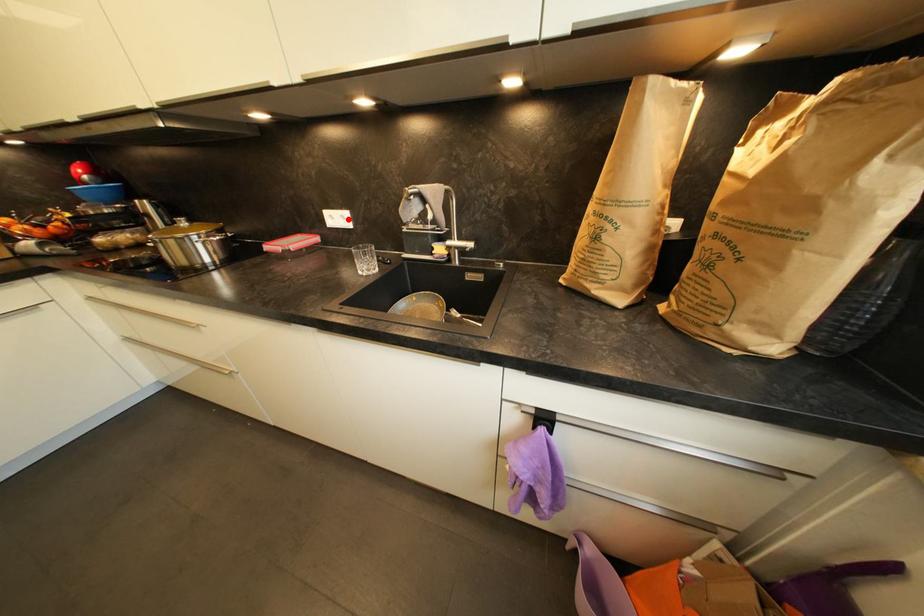
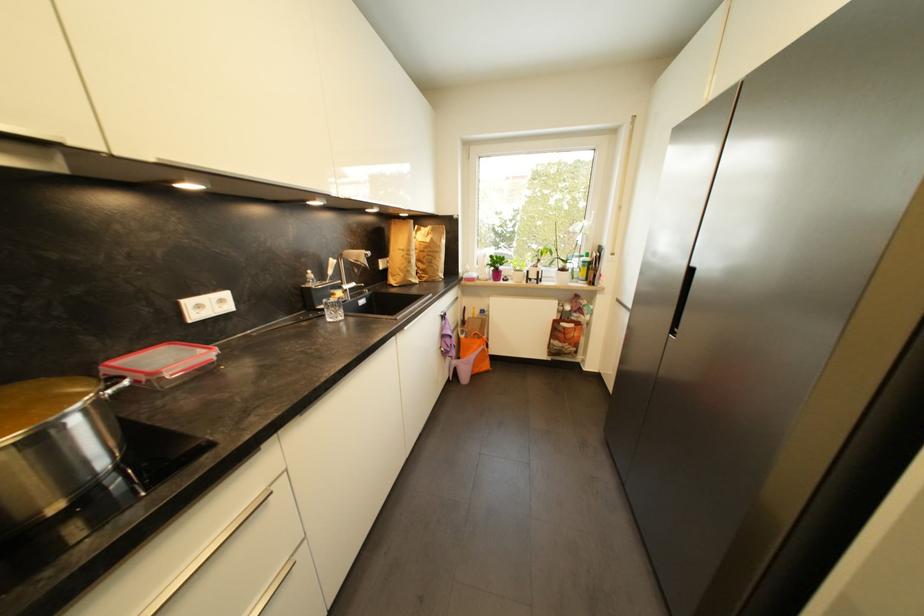
In the second image, find the point that corresponds to the highlighted location in the first image.

(226, 302)